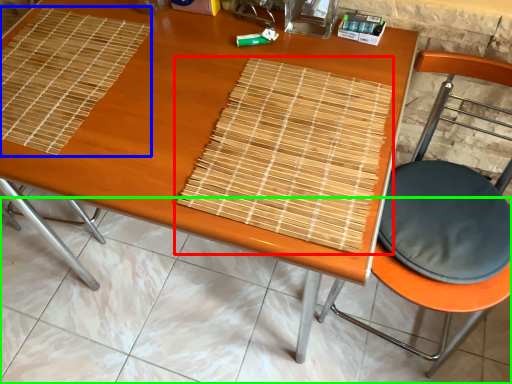
Question: Based on their relative distances, which object is farther from mat (highlighted by a red box)? Choose from mat (highlighted by a blue box) and tile (highlighted by a green box).

Choices:
 (A) mat
 (B) tile

Answer: (B)